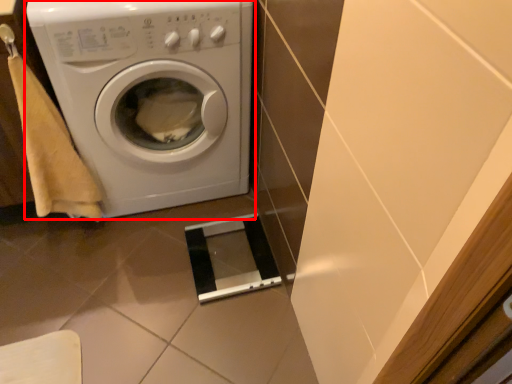
Question: From the image's perspective, what is the correct spatial relationship of washing machine (annotated by the red box) in relation to hand towel?

Choices:
 (A) below
 (B) above

Answer: (B)